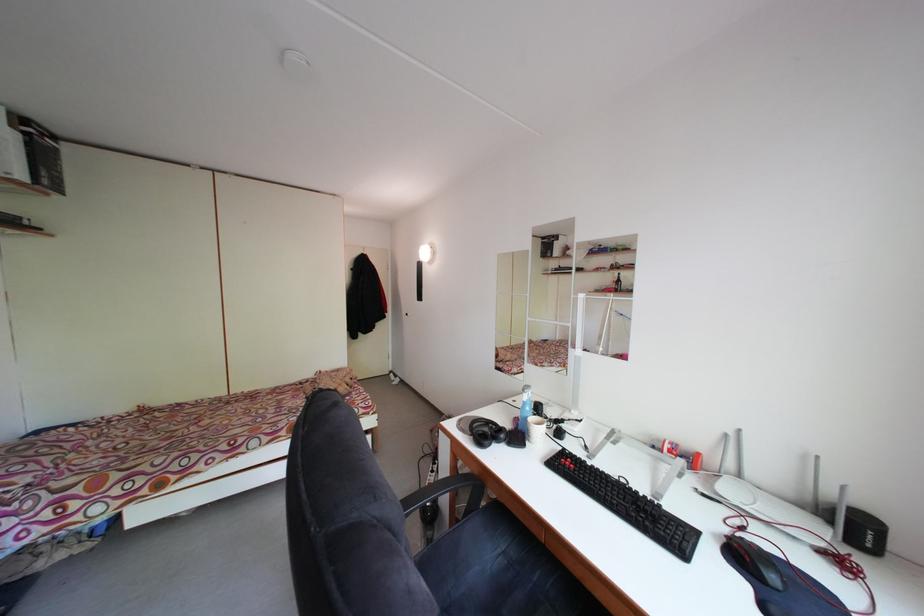
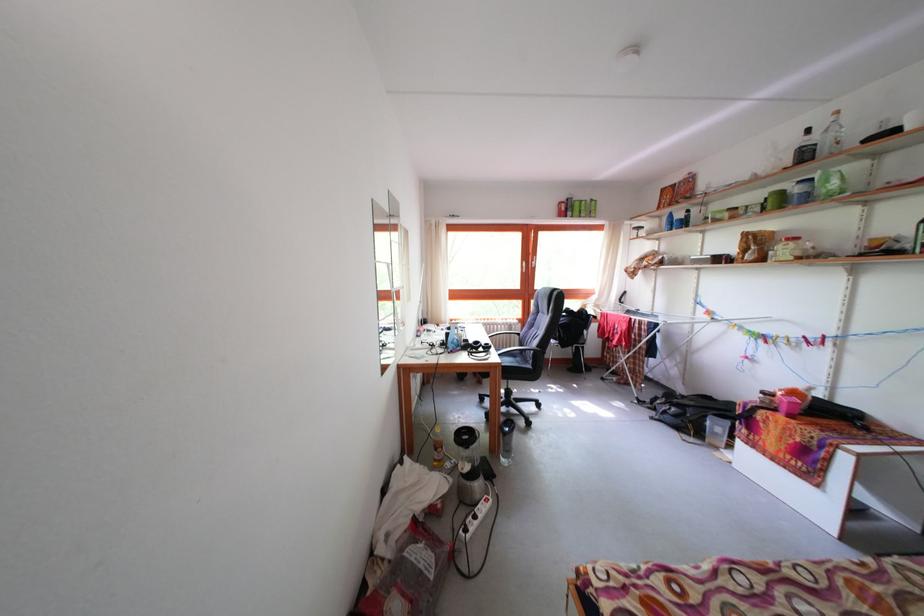
Question: I am providing you with two images of the same scene from different viewpoints. Please identify which objects are invisible in image2.

Choices:
 (A) yellow sticky notes
 (B) black headphones
 (C) black box
 (D) clear plastic bottle

Answer: (C)